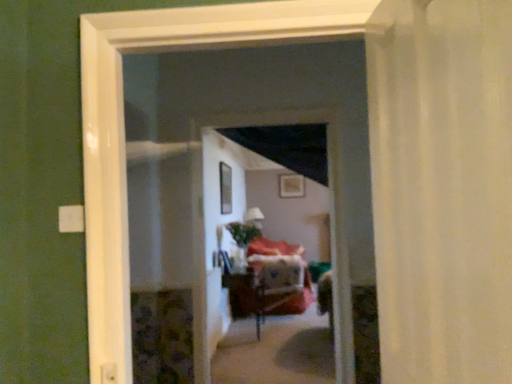
Question: Does transparent glass window at center have a greater height compared to wooden screen door at center?

Choices:
 (A) yes
 (B) no

Answer: (B)

Question: Is transparent glass window at center to the right of wooden screen door at center from the viewer's perspective?

Choices:
 (A) yes
 (B) no

Answer: (B)

Question: Is transparent glass window at center oriented away from wooden screen door at center?

Choices:
 (A) yes
 (B) no

Answer: (B)

Question: Considering the relative sizes of transparent glass window at center and wooden screen door at center in the image provided, is transparent glass window at center shorter than wooden screen door at center?

Choices:
 (A) yes
 (B) no

Answer: (A)

Question: Considering the relative sizes of transparent glass window at center and wooden screen door at center in the image provided, is transparent glass window at center thinner than wooden screen door at center?

Choices:
 (A) yes
 (B) no

Answer: (A)

Question: Would you say wooden screen door at center is part of transparent glass window at center's contents?

Choices:
 (A) no
 (B) yes

Answer: (A)

Question: Is wooden screen door at center positioned beyond the bounds of white sheer curtain at right?

Choices:
 (A) yes
 (B) no

Answer: (A)

Question: Does wooden screen door at center have a larger size compared to white sheer curtain at right?

Choices:
 (A) yes
 (B) no

Answer: (A)

Question: Is wooden screen door at center further to camera compared to white sheer curtain at right?

Choices:
 (A) no
 (B) yes

Answer: (B)

Question: Considering the relative sizes of wooden screen door at center and white sheer curtain at right in the image provided, is wooden screen door at center thinner than white sheer curtain at right?

Choices:
 (A) no
 (B) yes

Answer: (B)

Question: Can you confirm if wooden screen door at center is positioned to the right of white sheer curtain at right?

Choices:
 (A) no
 (B) yes

Answer: (A)

Question: Is wooden screen door at center smaller than white sheer curtain at right?

Choices:
 (A) no
 (B) yes

Answer: (A)

Question: From the image's perspective, is wooden table at center over transparent glass window at center?

Choices:
 (A) yes
 (B) no

Answer: (B)